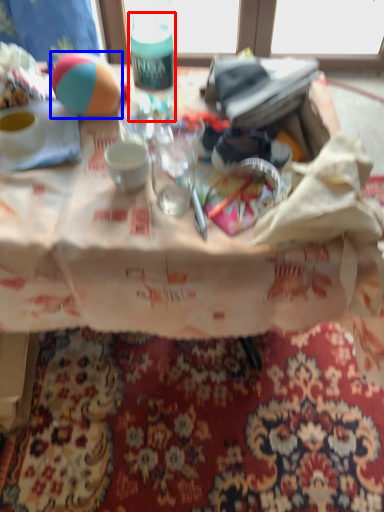
Question: Which object is closer to the camera taking this photo, bottle (highlighted by a red box) or ball (highlighted by a blue box)?

Choices:
 (A) bottle
 (B) ball

Answer: (A)